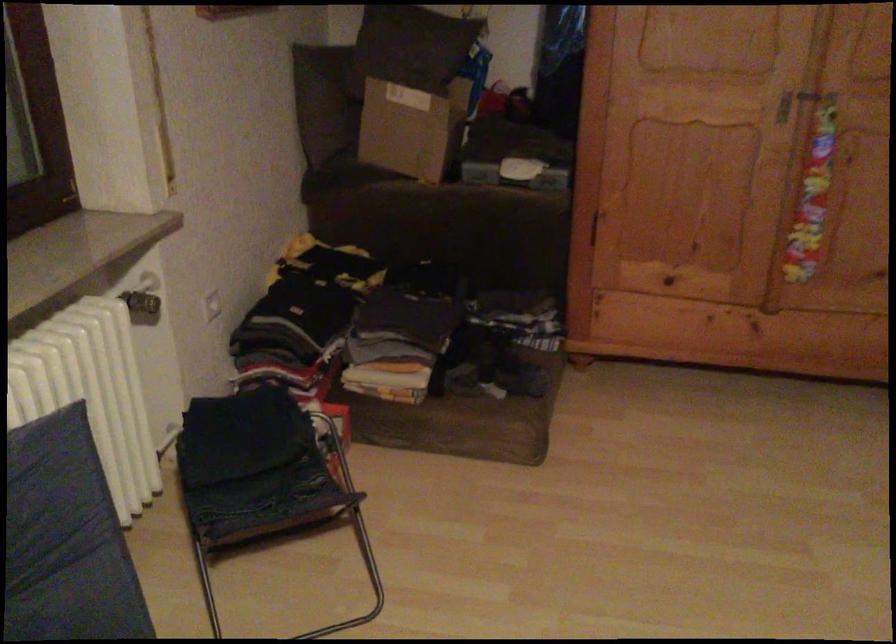
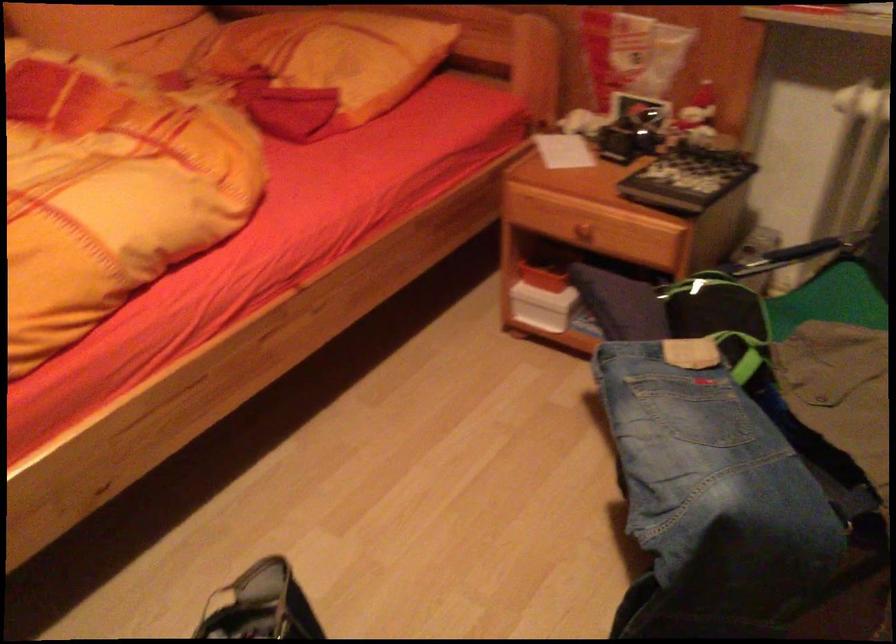
First-person continuous shooting, in which direction is the camera rotating?

The camera's rotation is toward left-down.